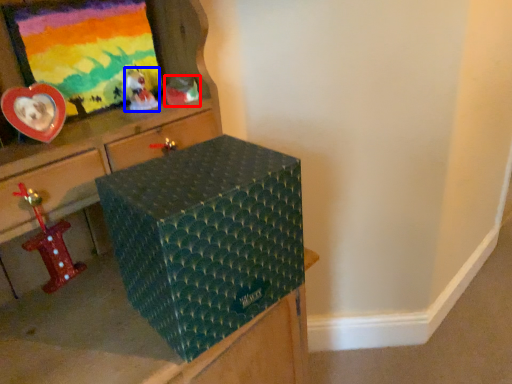
Question: Among these objects, which one is nearest to the camera, toy (highlighted by a red box) or toy (highlighted by a blue box)?

Choices:
 (A) toy
 (B) toy

Answer: (B)